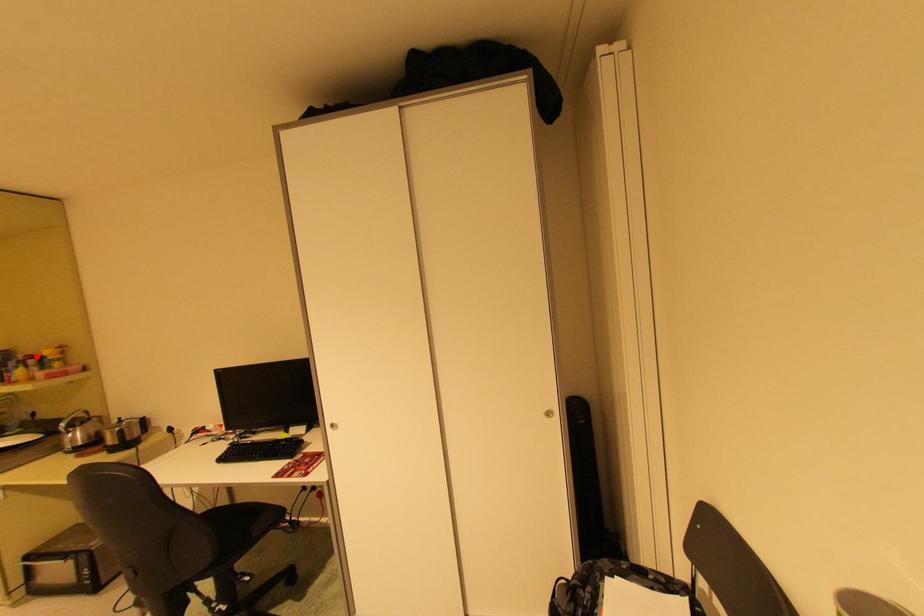
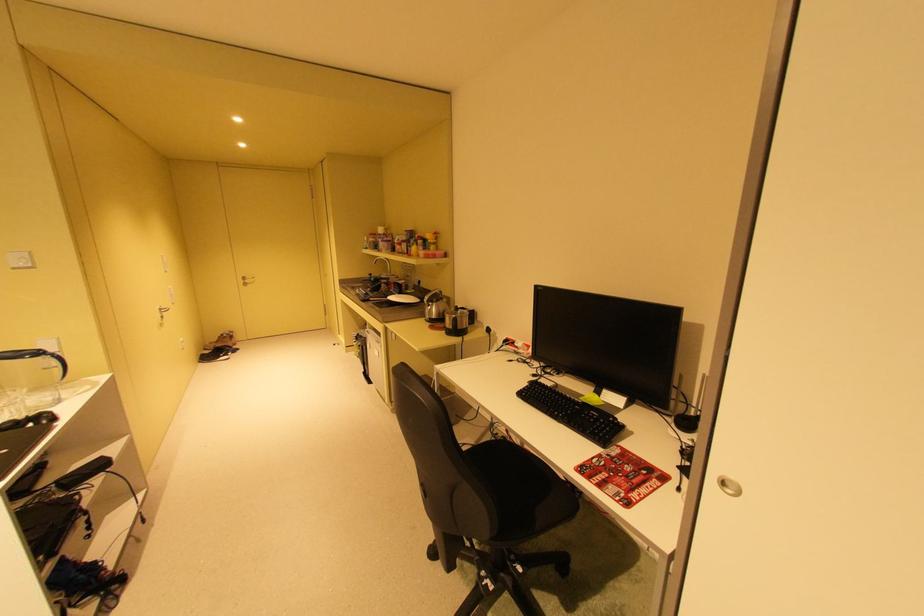
Find the pixel in the second image that matches the highlighted location in the first image.

(428, 237)